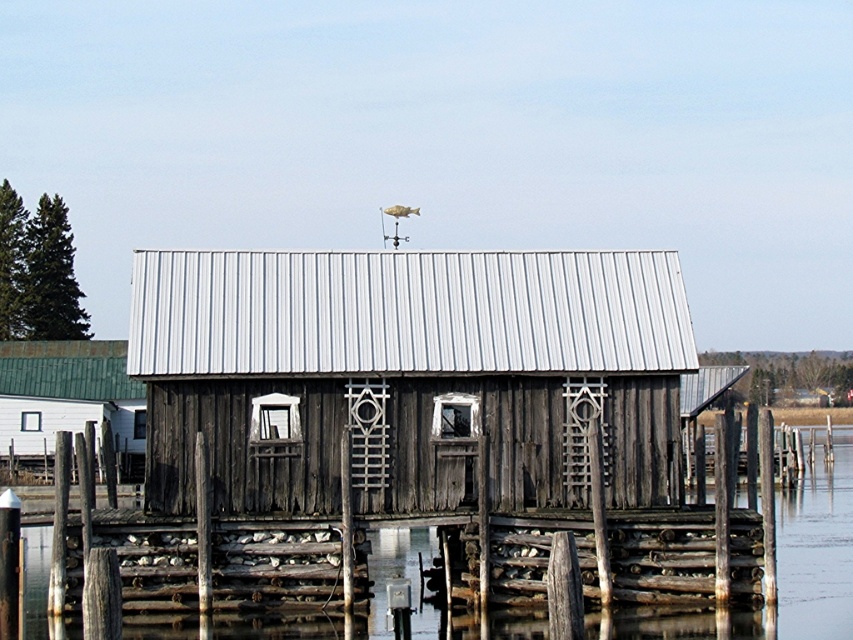
Can you confirm if transparent wooden water at lower center is positioned to the left of green wooden hut at left?

In fact, transparent wooden water at lower center is to the right of green wooden hut at left.

Describe the element at coordinates (811, 556) in the screenshot. I see `transparent wooden water at lower center` at that location.

You are a GUI agent. You are given a task and a screenshot of the screen. Output one action in this format:
    pyautogui.click(x=<x>, y=<y>)
    Task: Click on the transparent wooden water at lower center
    This screenshot has width=853, height=640.
    Given the screenshot: What is the action you would take?
    pyautogui.click(x=811, y=556)

What do you see at coordinates (408, 374) in the screenshot? I see `wooden cabin at center` at bounding box center [408, 374].

You are a GUI agent. You are given a task and a screenshot of the screen. Output one action in this format:
    pyautogui.click(x=<x>, y=<y>)
    Task: Click on the wooden cabin at center
    The height and width of the screenshot is (640, 853).
    Given the screenshot: What is the action you would take?
    [408, 374]

Locate an element on the screen. Image resolution: width=853 pixels, height=640 pixels. wooden cabin at center is located at coordinates (408, 374).

Is point (334, 456) positioned in front of point (305, 630)?

No, it is not.

What are the coordinates of `wooden cabin at center` in the screenshot? It's located at (408, 374).